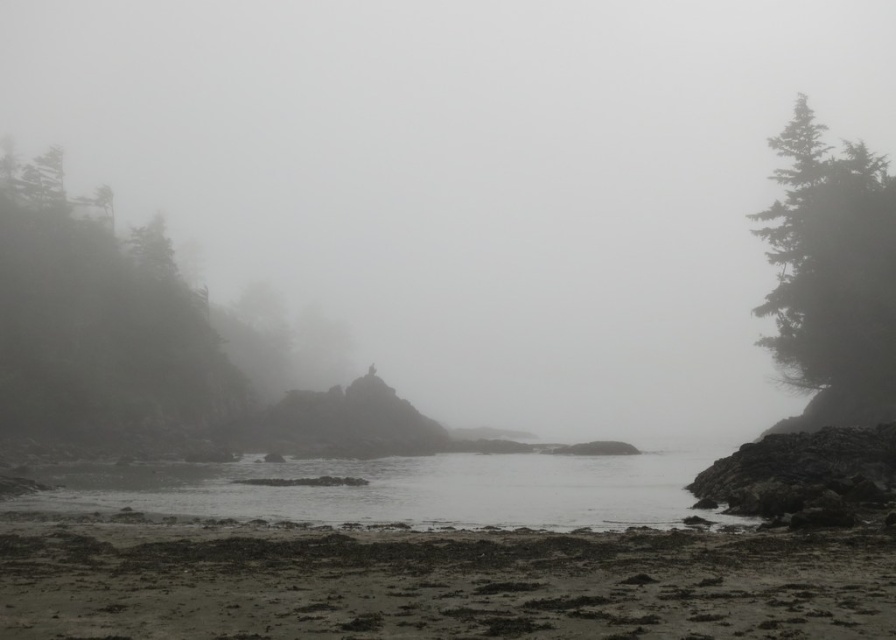
Identify the location of dark sand at lower center. tap(438, 582).

Which is more to the right, dark sand at lower center or green matte tree at left?

dark sand at lower center is more to the right.

This screenshot has height=640, width=896. I want to click on dark sand at lower center, so click(438, 582).

The width and height of the screenshot is (896, 640). I want to click on dark sand at lower center, so click(x=438, y=582).

Can you confirm if foggy mist at center is smaller than green matte tree at right?

No, foggy mist at center is not smaller than green matte tree at right.

Can you confirm if foggy mist at center is bigger than green matte tree at right?

Correct, foggy mist at center is larger in size than green matte tree at right.

What do you see at coordinates (470, 179) in the screenshot?
I see `foggy mist at center` at bounding box center [470, 179].

Find the location of a particular element. The image size is (896, 640). foggy mist at center is located at coordinates (470, 179).

Who is lower down, dark sand at lower center or gray matte water at center?

gray matte water at center is below.

Does dark sand at lower center appear over gray matte water at center?

Yes.

Between point (480, 560) and point (112, 484), which one is positioned in front?

Point (480, 560) is more forward.

Identify the location of dark sand at lower center. (438, 582).